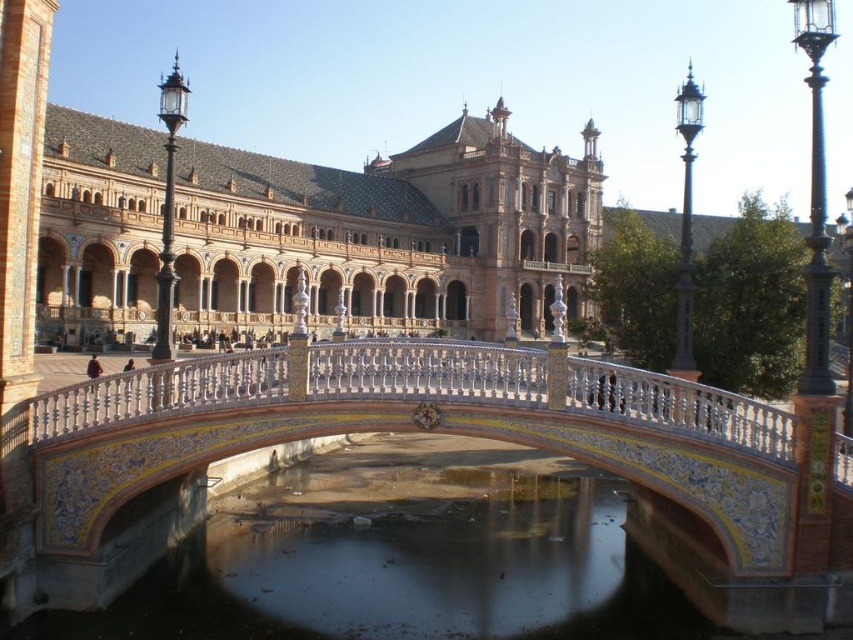
You are a tourist visiting Plaza de Spain and want to cross the decorative ceramic bridge at center to the other side. However, you notice the smooth concrete river at center below it. Do you think the bridge is wide enough for you to walk across without stepping into the river?

The smooth concrete river at center is narrower than the decorative ceramic bridge at center, meaning the bridge spans the river sufficiently. You can safely walk across the decorative ceramic bridge at center without stepping into the river.

You are a tourist standing on the decorative ceramic bridge at center. You want to take a photo of the smooth concrete river at center. Which direction should you point your camera to capture the river?

You should point your camera downward since the smooth concrete river at center is positioned under the decorative ceramic bridge at center.